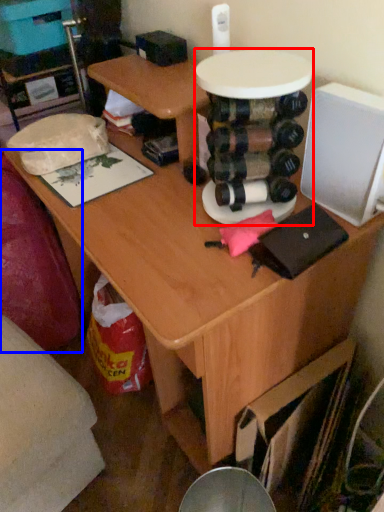
Question: Which object appears closest to the camera in this image, round table (highlighted by a red box) or swivel chair (highlighted by a blue box)?

Choices:
 (A) round table
 (B) swivel chair

Answer: (A)